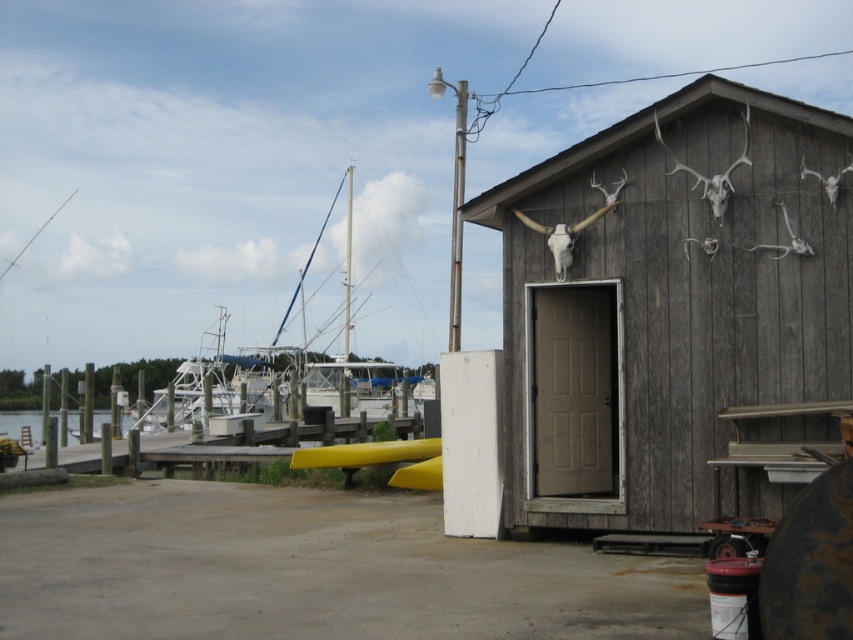
Is point (231, 438) behind point (9, 429)?

No, (231, 438) is in front of (9, 429).

Locate an element on the screen. The image size is (853, 640). yellow plastic dock at lower center is located at coordinates (213, 445).

Can you confirm if weathered wood hut at center is positioned below clear water at dock left?

No, weathered wood hut at center is not below clear water at dock left.

Which is behind, point (619, 246) or point (39, 412)?

Point (39, 412)

Does point (660, 314) lie in front of point (94, 412)?

Yes, point (660, 314) is in front of point (94, 412).

This screenshot has width=853, height=640. Identify the location of weathered wood hut at center. (675, 310).

What do you see at coordinates (675, 310) in the screenshot? I see `weathered wood hut at center` at bounding box center [675, 310].

Where is `weathered wood hut at center`? weathered wood hut at center is located at coordinates (675, 310).

Between point (639, 417) and point (341, 426), which one is positioned behind?

Positioned behind is point (341, 426).

Identify the location of weathered wood hut at center. (675, 310).